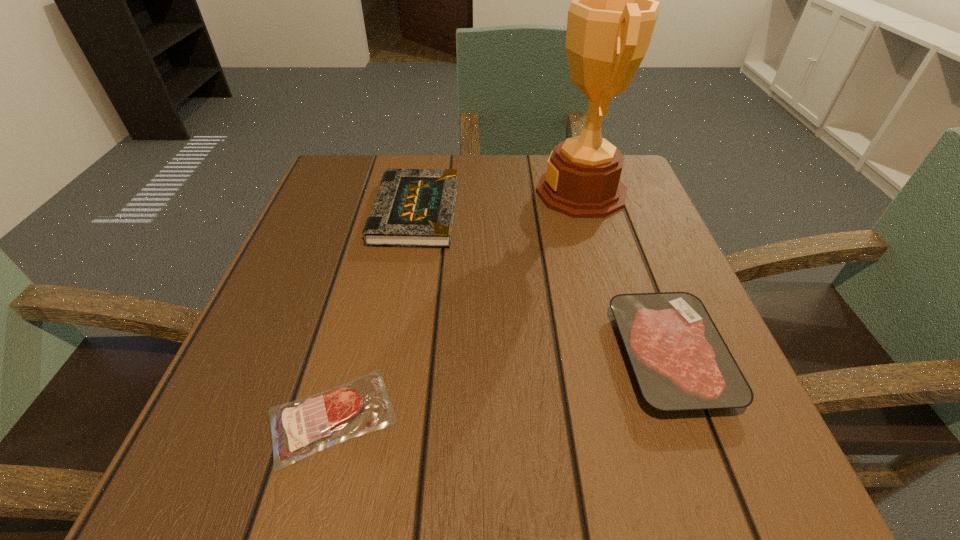
This screenshot has height=540, width=960. I want to click on the tallest object, so click(611, 19).

The height and width of the screenshot is (540, 960). I want to click on the second tallest object, so click(414, 207).

Locate an element on the screen. This screenshot has height=540, width=960. the second shortest object is located at coordinates (681, 362).

What are the coordinates of `the right steak` in the screenshot? It's located at (681, 362).

Locate an element on the screen. the left steak is located at coordinates (300, 428).

Locate an element on the screen. the shortest object is located at coordinates (300, 428).

Find the location of a particular element. This screenshot has width=960, height=540. free space located on the front-facing side of the tallest object is located at coordinates (504, 192).

Find the location of a particular element. The image size is (960, 540). vacant space located 0.080m on the front-facing side of the tallest object is located at coordinates (500, 192).

Where is `vacant space located on the front-facing side of the tallest object`? This screenshot has width=960, height=540. vacant space located on the front-facing side of the tallest object is located at coordinates (378, 192).

Image resolution: width=960 pixels, height=540 pixels. Find the location of `vacant space located 0.080m on the right of the third shortest object`. vacant space located 0.080m on the right of the third shortest object is located at coordinates (494, 212).